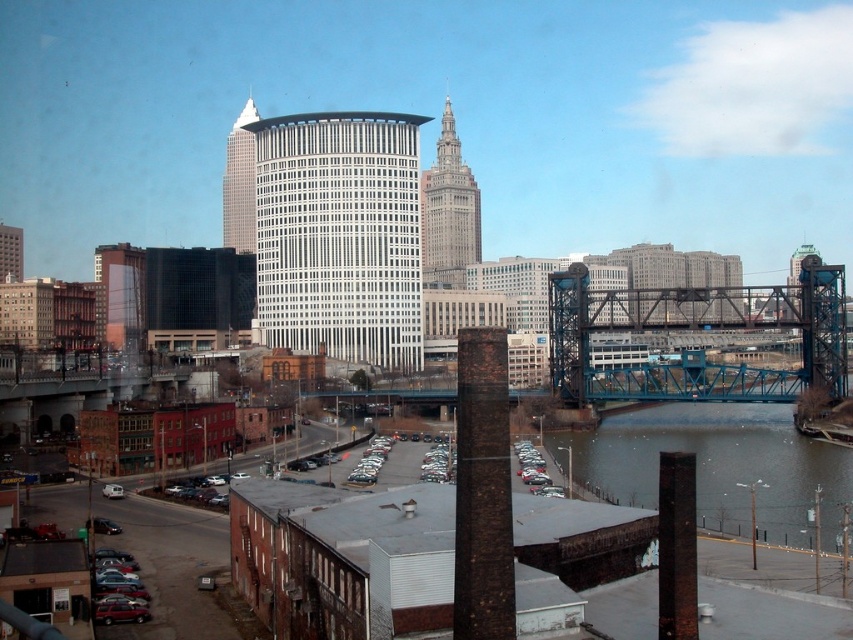
Does blue metallic bridge at right have a larger size compared to brown brick tower at center?

Incorrect, blue metallic bridge at right is not larger than brown brick tower at center.

Where is `blue metallic bridge at right`? Image resolution: width=853 pixels, height=640 pixels. blue metallic bridge at right is located at coordinates (698, 328).

Between point (399, 132) and point (238, 154), which one is positioned behind?

The point (238, 154) is more distant.

Who is lower down, white glass building at center or white glass skyscraper at upper center?

Positioned lower is white glass building at center.

Find the location of a particular element. white glass building at center is located at coordinates (339, 236).

Between white glass building at center and blue metallic bridge at right, which one appears on the right side from the viewer's perspective?

Positioned to the right is blue metallic bridge at right.

Does white glass building at center have a smaller size compared to blue metallic bridge at right?

Yes, white glass building at center is smaller than blue metallic bridge at right.

Which is behind, point (387, 172) or point (817, 328)?

The point (387, 172) is more distant.

Find the location of a particular element. Image resolution: width=853 pixels, height=640 pixels. white glass building at center is located at coordinates (339, 236).